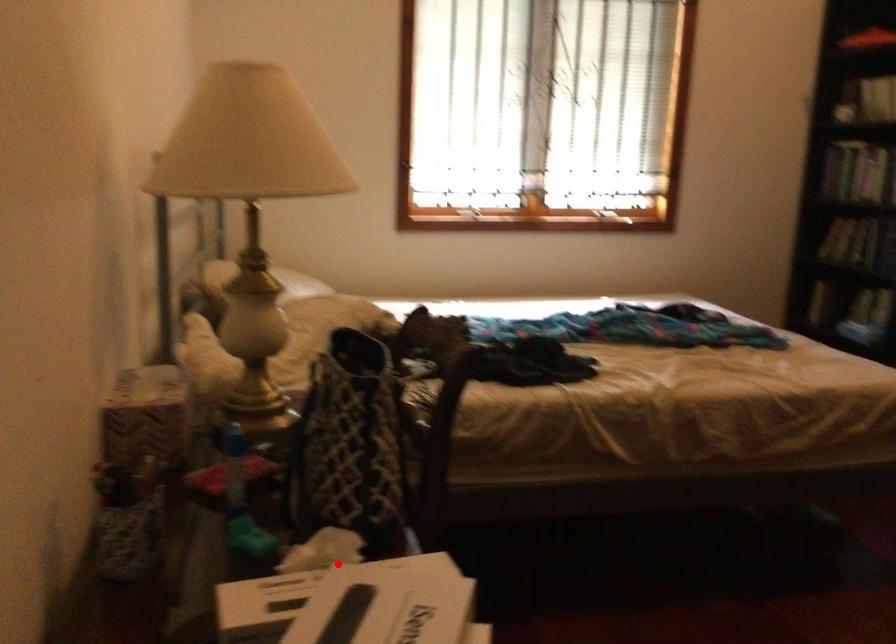
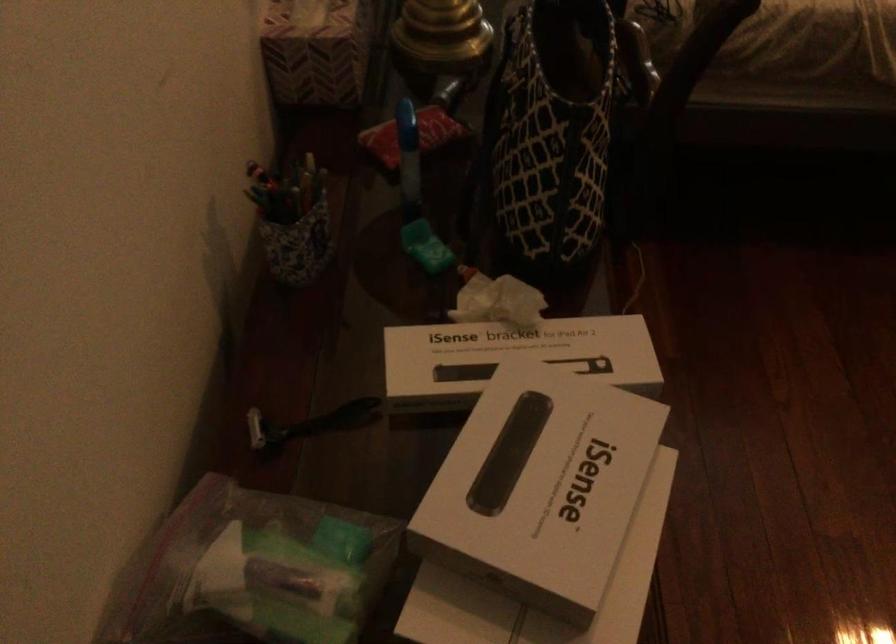
Question: I am providing you with two images of the same scene from different viewpoints. Image1 has a red point marked. In image2, the corresponding 3D location appears at what relative position? Reply with the corresponding letter.

Choices:
 (A) Closer
 (B) Farther

Answer: (A)